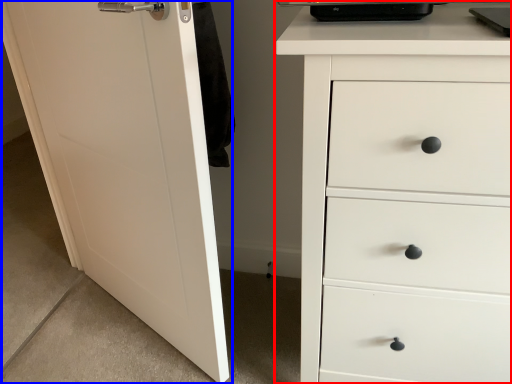
Question: Among these objects, which one is farthest to the camera, chest of drawers (highlighted by a red box) or door (highlighted by a blue box)?

Choices:
 (A) chest of drawers
 (B) door

Answer: (B)